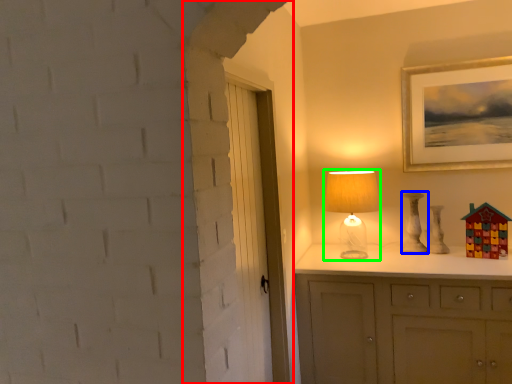
Question: Considering the real-world distances, which object is farthest from door (highlighted by a red box)? lamp (highlighted by a blue box) or table lamp (highlighted by a green box)?

Choices:
 (A) lamp
 (B) table lamp

Answer: (A)